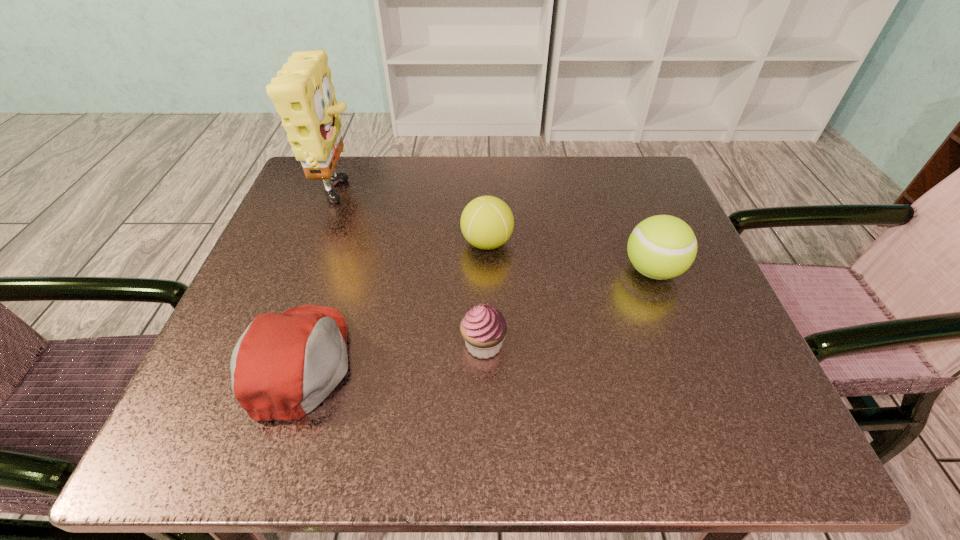
This screenshot has height=540, width=960. I want to click on vacant space at the right edge of the desktop, so click(630, 224).

At what (x,y) coordinates should I click in order to perform the action: click on free location at the far right corner of the desktop. Please return your answer as a coordinate pair (x, y). This screenshot has height=540, width=960. Looking at the image, I should click on (645, 196).

Find the location of a particular element. vacant point located between the left tennis ball and the right tennis ball is located at coordinates (569, 256).

Locate an element on the screen. The height and width of the screenshot is (540, 960). vacant space in between the cupcake and the sponge is located at coordinates (411, 271).

You are a GUI agent. You are given a task and a screenshot of the screen. Output one action in this format:
    pyautogui.click(x=<x>, y=<y>)
    Task: Click on the free space between the right tennis ball and the cupcake
    The width and height of the screenshot is (960, 540).
    Given the screenshot: What is the action you would take?
    pyautogui.click(x=568, y=308)

Image resolution: width=960 pixels, height=540 pixels. I want to click on free space between the rightmost object and the left tennis ball, so click(569, 256).

You are a GUI agent. You are given a task and a screenshot of the screen. Output one action in this format:
    pyautogui.click(x=<x>, y=<y>)
    Task: Click on the free space between the cupcake and the rightmost object
    
    Given the screenshot: What is the action you would take?
    pyautogui.click(x=568, y=308)

Identify the location of unoccupied area between the cupcake and the left tennis ball. The height and width of the screenshot is (540, 960). (485, 294).

The image size is (960, 540). I want to click on free space between the rightmost object and the cupcake, so click(568, 308).

Image resolution: width=960 pixels, height=540 pixels. I want to click on vacant area that lies between the left tennis ball and the cupcake, so click(x=485, y=294).